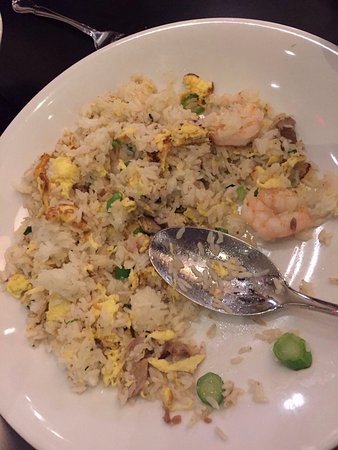
You are a GUI agent. You are given a task and a screenshot of the screen. Output one action in this format:
    pyautogui.click(x=<x>, y=<y>)
    Task: Click on the table
    Image resolution: width=338 pixels, height=450 pixels.
    Given the screenshot: What is the action you would take?
    pyautogui.click(x=28, y=83)